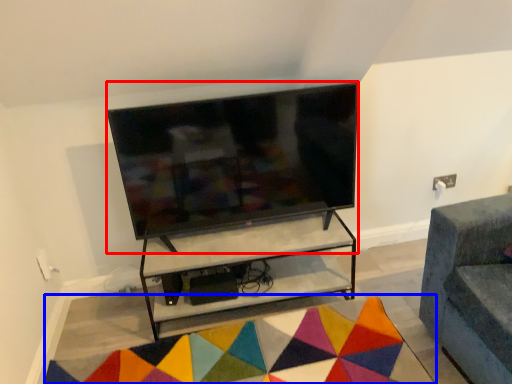
Question: Which point is further to the camera, television (highlighted by a red box) or mat (highlighted by a blue box)?

Choices:
 (A) television
 (B) mat

Answer: (A)